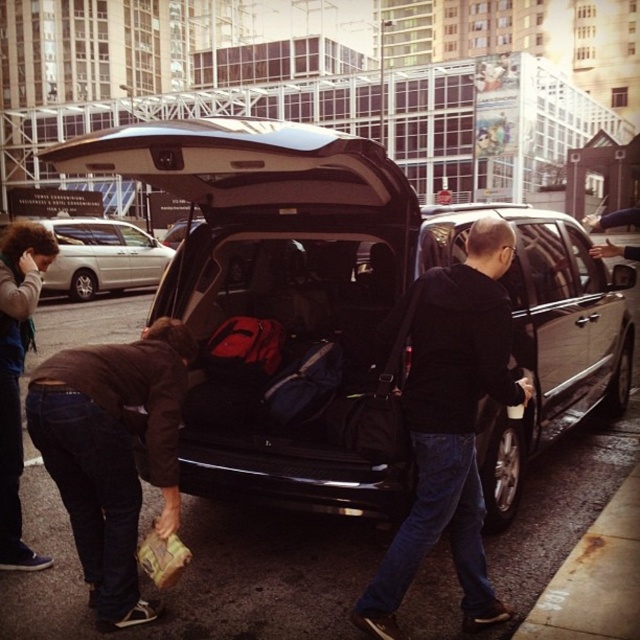
Question: Can you confirm if black leather car at center is wider than dark brown leather jacket at lower left?

Choices:
 (A) yes
 (B) no

Answer: (B)

Question: Does black leather jacket at center lie behind dark brown leather jacket at lower left?

Choices:
 (A) yes
 (B) no

Answer: (B)

Question: Which point is farther from the camera taking this photo?

Choices:
 (A) (444, 419)
 (B) (202, 292)
 (C) (120, 280)

Answer: (C)

Question: Which of the following is the farthest from the observer?

Choices:
 (A) silver metallic van at center
 (B) dark brown leather jacket at lower left

Answer: (A)

Question: Which point is farther to the camera?

Choices:
 (A) dark brown leather jacket at lower left
 (B) black leather jacket at center
 (C) black leather car at center
 (D) brown fabric bag at lower left

Answer: (A)

Question: Is black leather car at center positioned before silver metallic van at center?

Choices:
 (A) yes
 (B) no

Answer: (A)